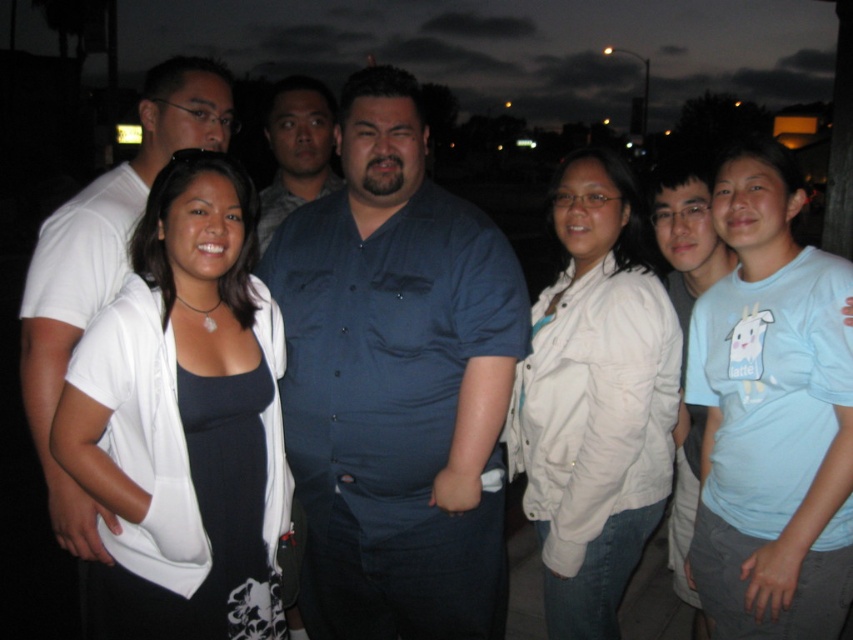
Question: Which of the following is the closest to the observer?

Choices:
 (A) (236, 284)
 (B) (315, 138)
 (C) (561, 232)

Answer: (A)

Question: Which object is farther from the camera taking this photo?

Choices:
 (A) white matte shirt at center
 (B) dark blue button-up shirt at center
 (C) matte blue shirt at center
 (D) white matte jacket at center

Answer: (C)

Question: Is white matte jacket at center positioned at the back of matte blue shirt at center?

Choices:
 (A) no
 (B) yes

Answer: (A)

Question: Based on their relative distances, which object is nearer to the white matte jacket at center?

Choices:
 (A) white matte shirt at center
 (B) matte blue shirt at center
 (C) dark blue button-up shirt at center

Answer: (C)

Question: Is dark blue button-up shirt at center to the left of white matte shirt at center from the viewer's perspective?

Choices:
 (A) no
 (B) yes

Answer: (A)

Question: Is dark blue button-up shirt at center in front of white matte jacket at center?

Choices:
 (A) no
 (B) yes

Answer: (B)